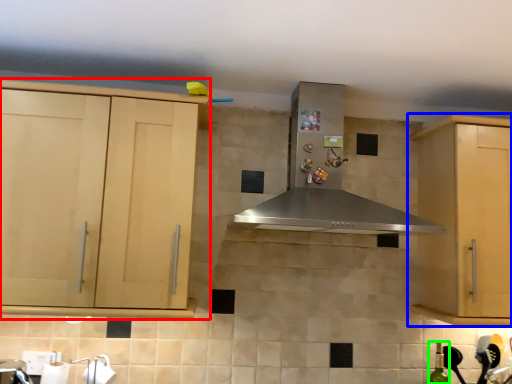
Question: Estimate the real-world distances between objects in this image. Which object is closer to cabinetry (highlighted by a red box), cabinetry (highlighted by a blue box) or bottle (highlighted by a green box)?

Choices:
 (A) cabinetry
 (B) bottle

Answer: (A)